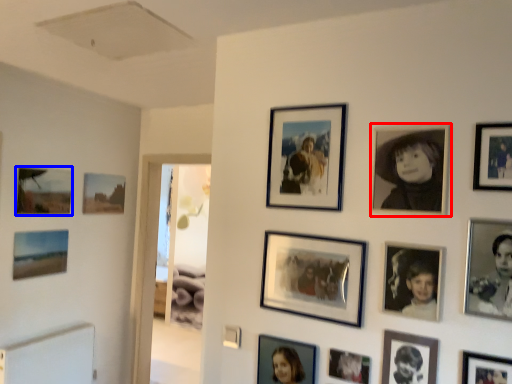
Question: Which object is closer to the camera taking this photo, picture frame (highlighted by a red box) or picture frame (highlighted by a blue box)?

Choices:
 (A) picture frame
 (B) picture frame

Answer: (A)